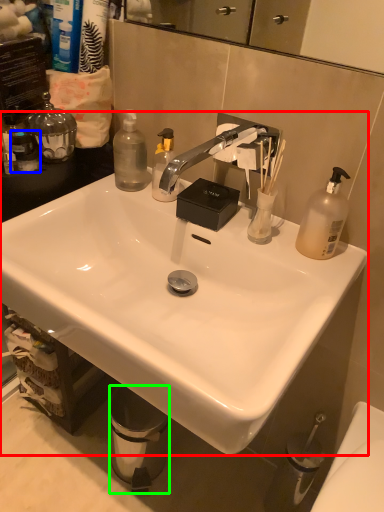
Question: Considering the real-world distances, which object is closest to sink (highlighted by a red box)? toiletry (highlighted by a blue box) or trash bin/can (highlighted by a green box).

Choices:
 (A) toiletry
 (B) trash bin/can

Answer: (A)